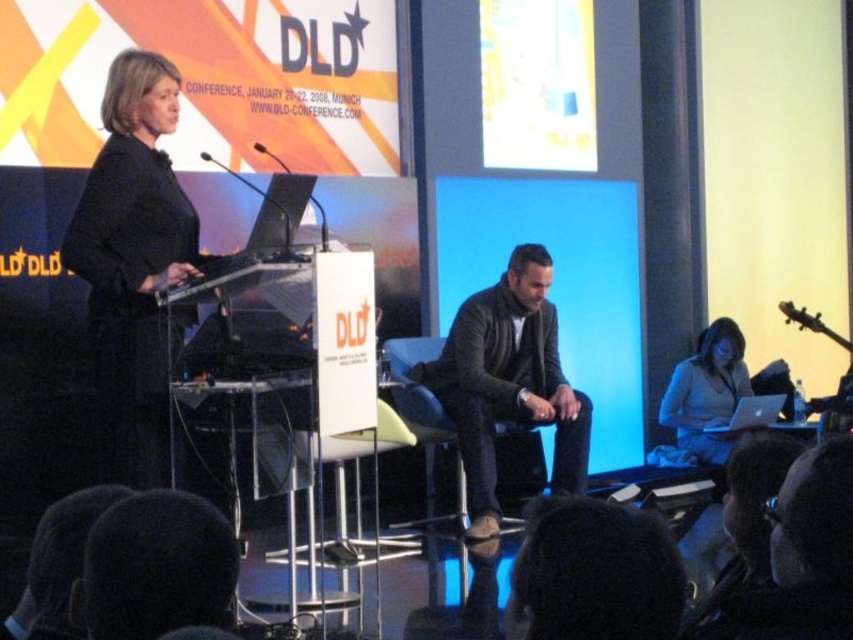
Question: Which object is closer to the camera taking this photo?

Choices:
 (A) dark brown leather jacket at lower center
 (B) matte white laptop at lower right

Answer: (A)

Question: Can you confirm if black leather jacket at lower center is thinner than dark brown leather jacket at lower center?

Choices:
 (A) yes
 (B) no

Answer: (B)

Question: Estimate the real-world distances between objects in this image. Which object is closer to the black leather jacket at lower center?

Choices:
 (A) black matte blazer at left
 (B) leather jacket at center

Answer: (A)

Question: Based on their relative distances, which object is nearer to the leather jacket at center?

Choices:
 (A) matte white laptop at lower right
 (B) black leather jacket at lower center

Answer: (A)

Question: Observing the image, what is the correct spatial positioning of black matte blazer at left in reference to leather jacket at center?

Choices:
 (A) left
 (B) right

Answer: (A)

Question: Is the position of leather jacket at center more distant than that of matte white laptop at lower right?

Choices:
 (A) no
 (B) yes

Answer: (A)